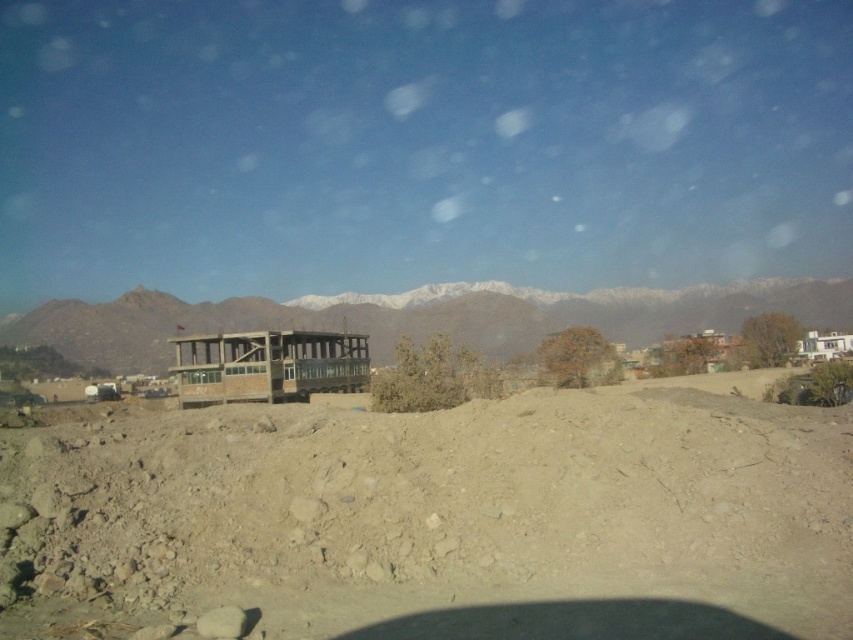
Is point (699, 451) in front of point (250, 397)?

That is True.

Which is more to the right, brown sandy dirt field at center or brown wooden gazebo at center?

brown sandy dirt field at center

The image size is (853, 640). In order to click on brown sandy dirt field at center in this screenshot , I will do `click(438, 518)`.

Which is more to the left, brown sandy dirt field at center or snowy rocky mountain at center?

Positioned to the left is brown sandy dirt field at center.

Which is above, brown sandy dirt field at center or snowy rocky mountain at center?

snowy rocky mountain at center

Is point (485, 451) behind point (596, 291)?

No, it is not.

Identify the location of brown sandy dirt field at center. (438, 518).

Between snowy rocky mountain at center and brown wooden gazebo at center, which one has less height?

With less height is brown wooden gazebo at center.

Is snowy rocky mountain at center to the right of brown wooden gazebo at center from the viewer's perspective?

Correct, you'll find snowy rocky mountain at center to the right of brown wooden gazebo at center.

Is point (740, 291) positioned in front of point (244, 394)?

No, it is behind (244, 394).

Find the location of `snowy rocky mountain at center`. snowy rocky mountain at center is located at coordinates (418, 317).